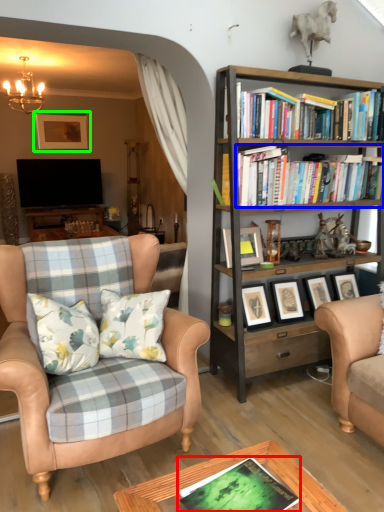
Question: Which object is the closest to the book (highlighted by a red box)? Choose among these: book (highlighted by a blue box) or picture frame (highlighted by a green box).

Choices:
 (A) book
 (B) picture frame

Answer: (A)